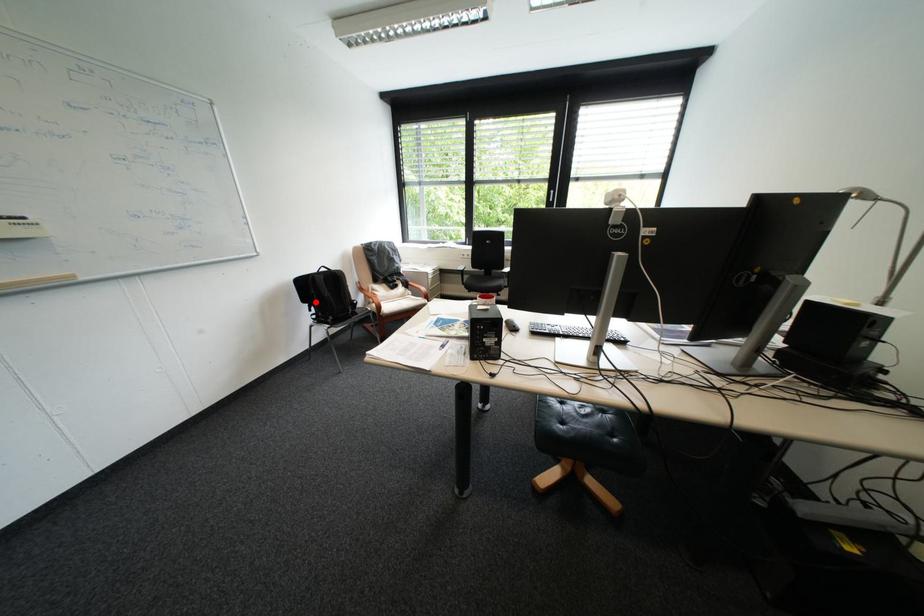
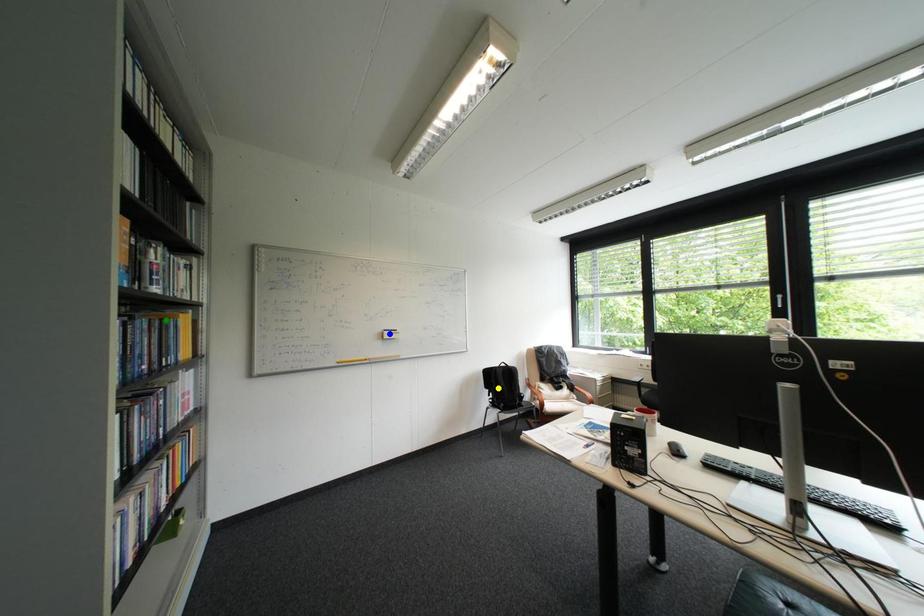
Question: I am providing you with two images of the same scene from different viewpoints. A red point is marked on the first image. You are given multiple points on the second image. Which spot in image 2 lines up with the point in image 1?

Choices:
 (A) green point
 (B) blue point
 (C) yellow point

Answer: (C)